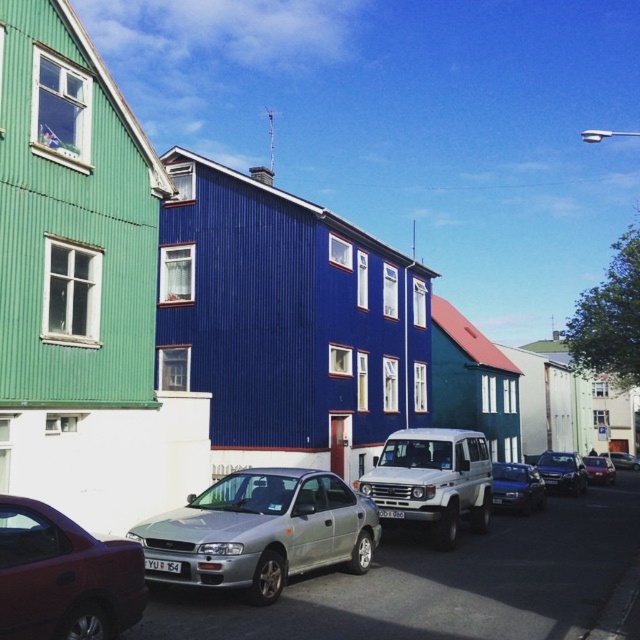
Question: Can you confirm if shiny red sedan at lower left is positioned above metallic silver sedan at center?

Choices:
 (A) yes
 (B) no

Answer: (A)

Question: Among these objects, which one is nearest to the camera?

Choices:
 (A) metallic blue sedan at center
 (B) white matte van at center

Answer: (B)

Question: Can you confirm if silver metallic car at center is positioned below metallic silver sedan at center?

Choices:
 (A) no
 (B) yes

Answer: (A)

Question: Can you confirm if metallic blue sedan at center is positioned to the right of metallic silver sedan at center-right?

Choices:
 (A) yes
 (B) no

Answer: (B)

Question: Which object appears closest to the camera in this image?

Choices:
 (A) metallic blue sedan at center
 (B) metallic silver sedan at center
 (C) satin black sedan at center

Answer: (A)

Question: Which point is farther to the camera?

Choices:
 (A) (528, 490)
 (B) (552, 458)
 (C) (474, 502)
 (D) (129, 588)

Answer: (B)